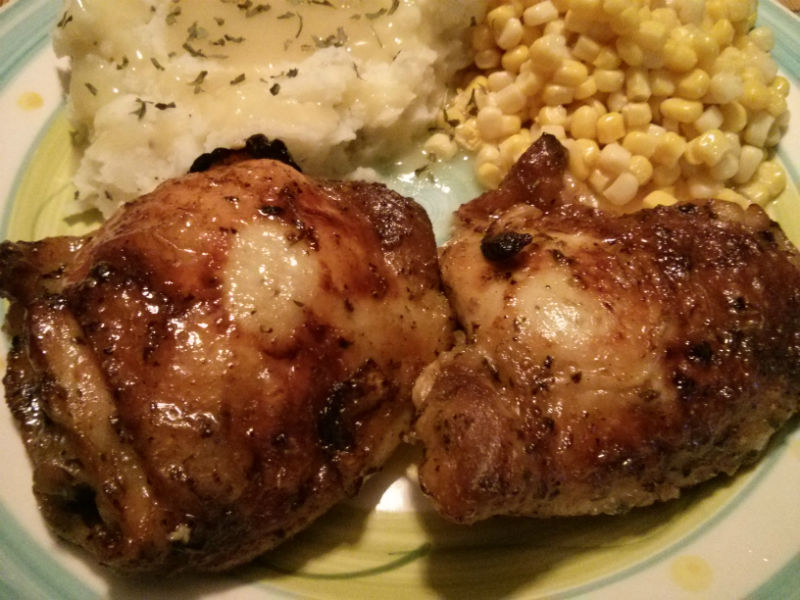
Identify the location of plate. The width and height of the screenshot is (800, 600). (442, 195), (2, 56), (36, 179), (2, 438), (33, 570), (370, 557), (693, 547), (749, 510), (794, 56).